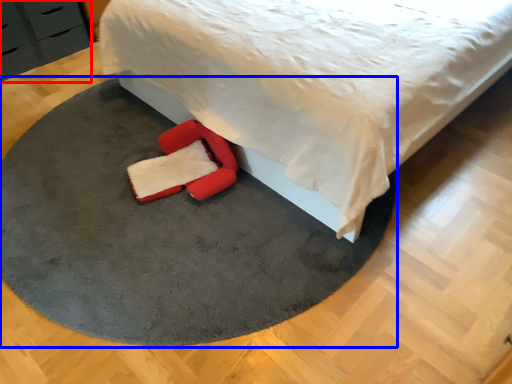
Question: Which point is closer to the camera, dresser (highlighted by a red box) or mat (highlighted by a blue box)?

Choices:
 (A) dresser
 (B) mat

Answer: (B)